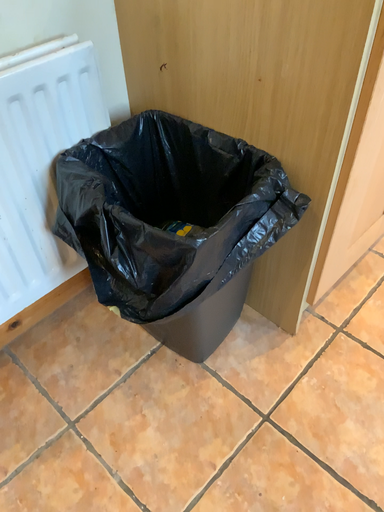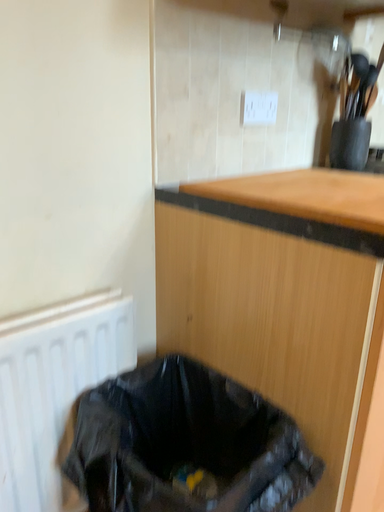
Question: Which way did the camera rotate in the video?

Choices:
 (A) rotated upward
 (B) rotated downward

Answer: (A)